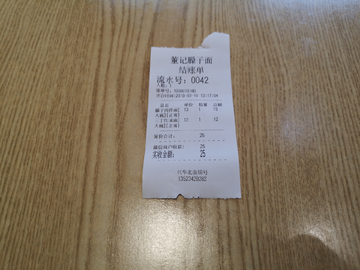
Locate an element on the screen. The width and height of the screenshot is (360, 270). table is located at coordinates (49, 161).